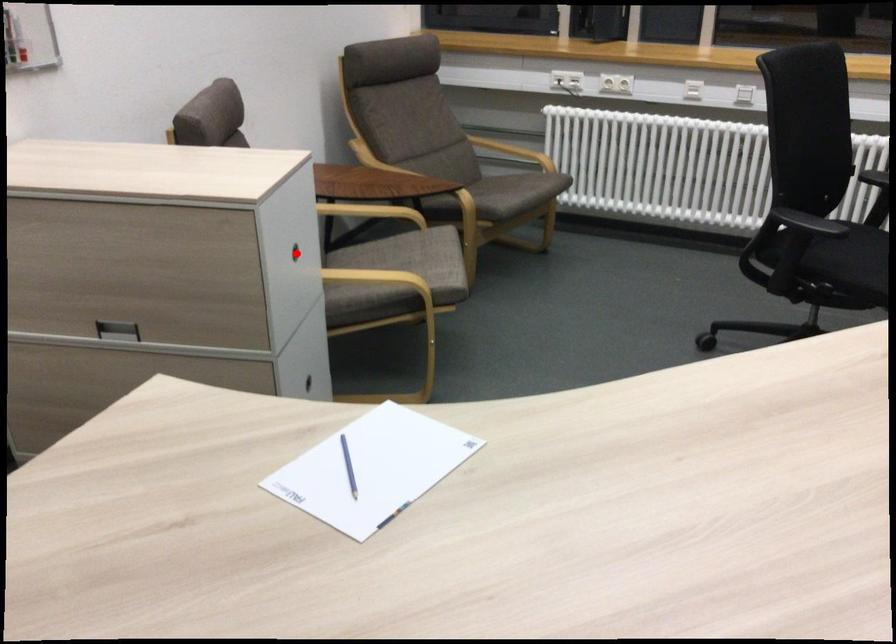
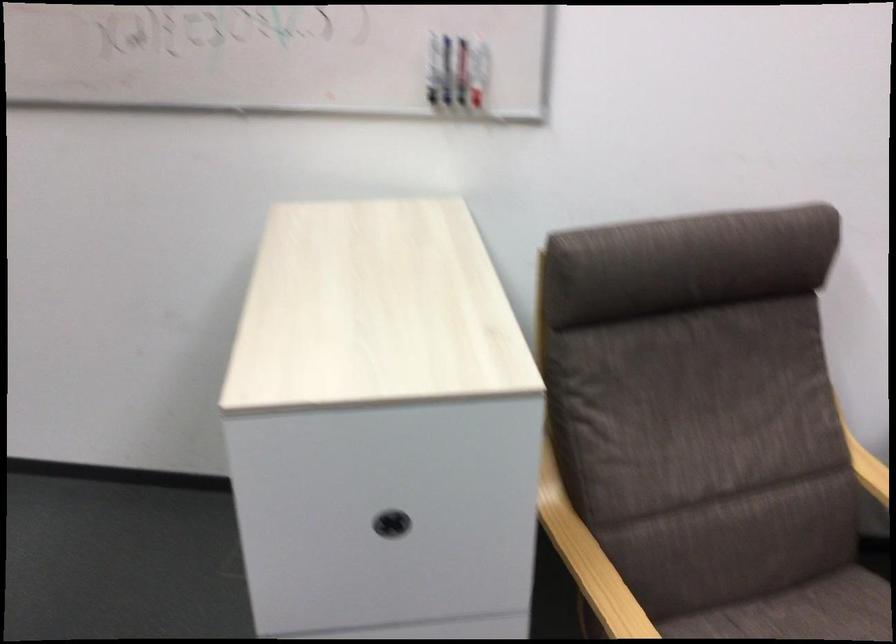
Question: I am providing you with two images of the same scene from different viewpoints. A red point is shown in image1. For the corresponding object point in image2, is it positioned nearer or farther from the camera?

Choices:
 (A) Nearer
 (B) Farther

Answer: (A)